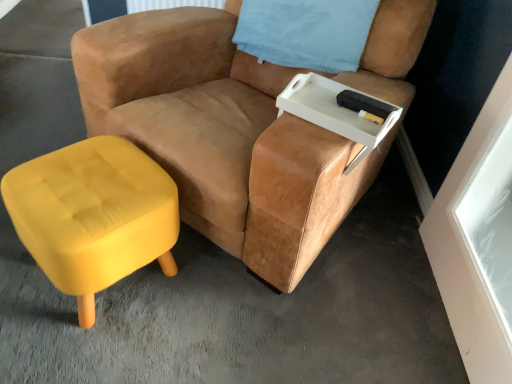
You are a GUI agent. You are given a task and a screenshot of the screen. Output one action in this format:
    pyautogui.click(x=<x>, y=<y>)
    Task: Click on the free space above velvet yellow ottoman at lower left (from a real-world perspective)
    This screenshot has width=512, height=384.
    Given the screenshot: What is the action you would take?
    pyautogui.click(x=89, y=186)